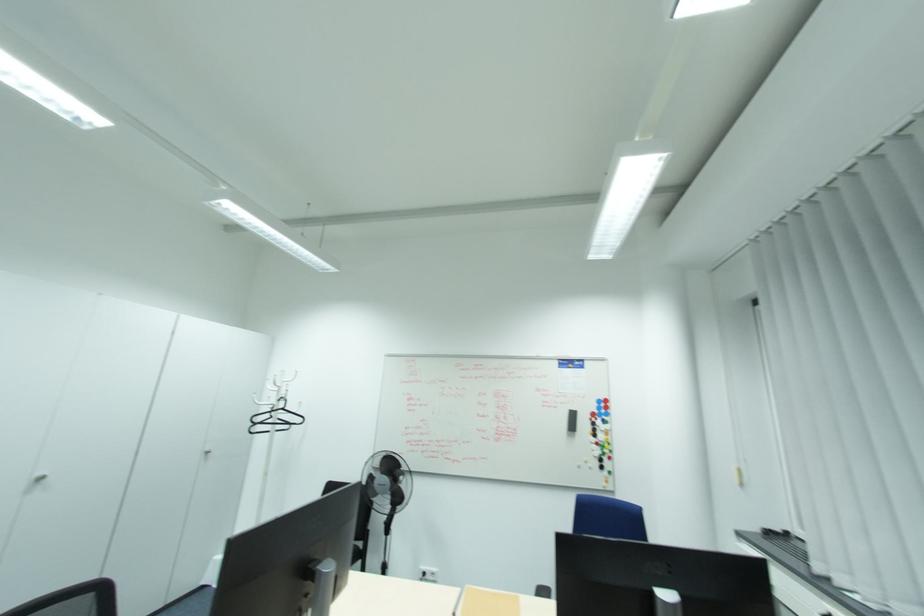
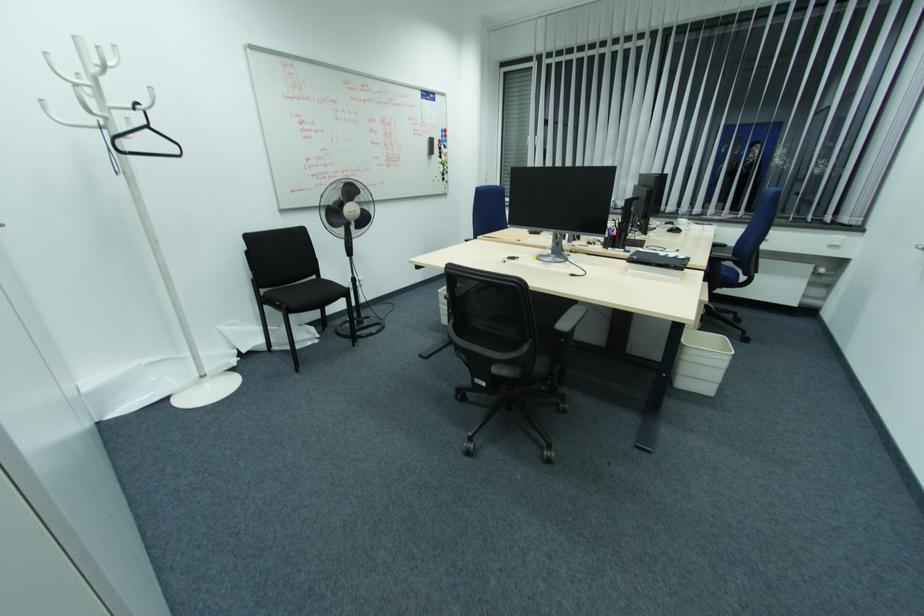
Find the pixel in the second image that matches (x=599, y=402) in the first image.

(444, 131)